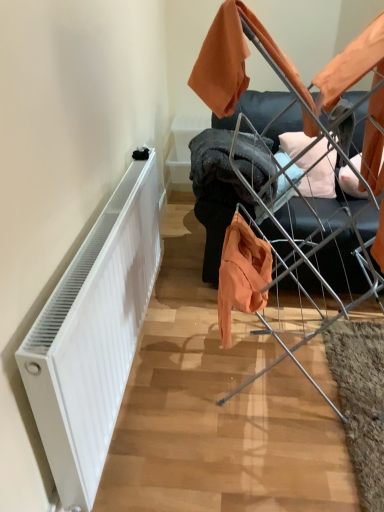
Question: Is there a large distance between metallic silver baby carriage at center and metal wire drying rack at upper right?

Choices:
 (A) yes
 (B) no

Answer: (B)

Question: Is metallic silver baby carriage at center to the left of metal wire drying rack at upper right from the viewer's perspective?

Choices:
 (A) no
 (B) yes

Answer: (B)

Question: Can you confirm if metallic silver baby carriage at center is wider than metal wire drying rack at upper right?

Choices:
 (A) yes
 (B) no

Answer: (B)

Question: Is metallic silver baby carriage at center completely or partially outside of metal wire drying rack at upper right?

Choices:
 (A) no
 (B) yes

Answer: (B)

Question: Does metallic silver baby carriage at center have a larger size compared to metal wire drying rack at upper right?

Choices:
 (A) yes
 (B) no

Answer: (A)

Question: In terms of height, does metallic silver baby carriage at center look taller or shorter compared to white matte radiator at left?

Choices:
 (A) short
 (B) tall

Answer: (B)

Question: In terms of size, does metallic silver baby carriage at center appear bigger or smaller than white matte radiator at left?

Choices:
 (A) big
 (B) small

Answer: (A)

Question: Is point (241, 287) closer or farther from the camera than point (29, 371)?

Choices:
 (A) farther
 (B) closer

Answer: (A)

Question: Which is correct: metallic silver baby carriage at center is inside white matte radiator at left, or outside of it?

Choices:
 (A) outside
 (B) inside

Answer: (A)

Question: Is metallic silver baby carriage at center in front of or behind metal wire drying rack at upper right in the image?

Choices:
 (A) behind
 (B) front

Answer: (B)

Question: Is metallic silver baby carriage at center spatially inside metal wire drying rack at upper right, or outside of it?

Choices:
 (A) outside
 (B) inside

Answer: (A)

Question: From a real-world perspective, is metallic silver baby carriage at center physically located above or below metal wire drying rack at upper right?

Choices:
 (A) above
 (B) below

Answer: (A)

Question: Is metallic silver baby carriage at center wider or thinner than metal wire drying rack at upper right?

Choices:
 (A) wide
 (B) thin

Answer: (B)

Question: From the image's perspective, is white matte radiator at left above or below metallic silver baby carriage at center?

Choices:
 (A) below
 (B) above

Answer: (A)

Question: Is white matte radiator at left bigger or smaller than metallic silver baby carriage at center?

Choices:
 (A) small
 (B) big

Answer: (A)